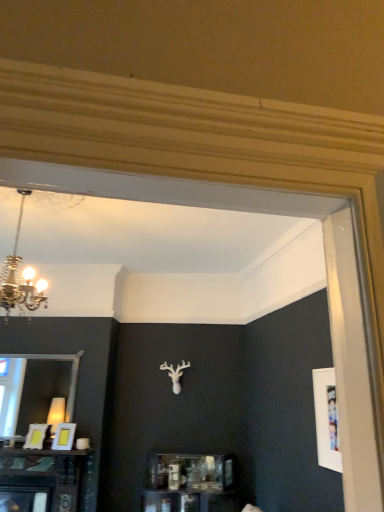
In the scene shown: What is the approximate height of matte white picture frame at lower left, positioned as the second picture frame in left-to-right order?

It is 11.27 inches.

Image resolution: width=384 pixels, height=512 pixels. Describe the element at coordinates (64, 436) in the screenshot. I see `matte white picture frame at lower left, positioned as the second picture frame in left-to-right order` at that location.

Where is `matte white picture frame at lower left, acting as the 1th picture frame starting from the right`? matte white picture frame at lower left, acting as the 1th picture frame starting from the right is located at coordinates (64, 436).

This screenshot has height=512, width=384. I want to click on matte yellow picture frame at lower left, marked as the first picture frame in a left-to-right arrangement, so click(x=36, y=436).

Image resolution: width=384 pixels, height=512 pixels. Describe the element at coordinates (36, 436) in the screenshot. I see `matte yellow picture frame at lower left, the second picture frame positioned from the right` at that location.

What is the approximate width of matte yellow picture frame at lower left, the second picture frame positioned from the right?

It is 3.51 inches.

Where is `matte white picture frame at lower left, positioned as the second picture frame in left-to-right order`? Image resolution: width=384 pixels, height=512 pixels. matte white picture frame at lower left, positioned as the second picture frame in left-to-right order is located at coordinates (64, 436).

Which object is positioned more to the left, matte white picture frame at lower left, acting as the 1th picture frame starting from the right, or matte yellow picture frame at lower left, marked as the first picture frame in a left-to-right arrangement?

matte yellow picture frame at lower left, marked as the first picture frame in a left-to-right arrangement, is more to the left.

Considering the relative positions of matte white picture frame at lower left, acting as the 1th picture frame starting from the right, and matte yellow picture frame at lower left, the second picture frame positioned from the right, in the image provided, is matte white picture frame at lower left, acting as the 1th picture frame starting from the right, behind matte yellow picture frame at lower left, the second picture frame positioned from the right,?

That is False.

Consider the image. Which point is more distant from viewer, (63, 426) or (27, 443)?

Point (27, 443)

From the image's perspective, is matte white picture frame at lower left, positioned as the second picture frame in left-to-right order, on matte yellow picture frame at lower left, marked as the first picture frame in a left-to-right arrangement?

Correct, matte white picture frame at lower left, positioned as the second picture frame in left-to-right order, appears higher than matte yellow picture frame at lower left, marked as the first picture frame in a left-to-right arrangement, in the image.

From a real-world perspective, does matte white picture frame at lower left, positioned as the second picture frame in left-to-right order, stand above matte yellow picture frame at lower left, the second picture frame positioned from the right?

Yes.

Is matte white picture frame at lower left, positioned as the second picture frame in left-to-right order, wider than matte yellow picture frame at lower left, the second picture frame positioned from the right?

Indeed, matte white picture frame at lower left, positioned as the second picture frame in left-to-right order, has a greater width compared to matte yellow picture frame at lower left, the second picture frame positioned from the right.

Does matte white picture frame at lower left, acting as the 1th picture frame starting from the right, have a lesser height compared to matte yellow picture frame at lower left, marked as the first picture frame in a left-to-right arrangement?

No, matte white picture frame at lower left, acting as the 1th picture frame starting from the right, is not shorter than matte yellow picture frame at lower left, marked as the first picture frame in a left-to-right arrangement.

Can you confirm if matte white picture frame at lower left, positioned as the second picture frame in left-to-right order, is bigger than matte yellow picture frame at lower left, the second picture frame positioned from the right?

Correct, matte white picture frame at lower left, positioned as the second picture frame in left-to-right order, is larger in size than matte yellow picture frame at lower left, the second picture frame positioned from the right.

Does matte white picture frame at lower left, positioned as the second picture frame in left-to-right order, contain matte yellow picture frame at lower left, the second picture frame positioned from the right?

That's incorrect, matte yellow picture frame at lower left, the second picture frame positioned from the right, is not inside matte white picture frame at lower left, positioned as the second picture frame in left-to-right order.

Is matte white picture frame at lower left, positioned as the second picture frame in left-to-right order, next to matte yellow picture frame at lower left, the second picture frame positioned from the right, and touching it?

matte white picture frame at lower left, positioned as the second picture frame in left-to-right order, is not next to matte yellow picture frame at lower left, the second picture frame positioned from the right, and they're not touching.

Is matte white picture frame at lower left, acting as the 1th picture frame starting from the right, turned away from matte yellow picture frame at lower left, the second picture frame positioned from the right?

No, matte yellow picture frame at lower left, the second picture frame positioned from the right, is not at the back of matte white picture frame at lower left, acting as the 1th picture frame starting from the right.

How many degrees apart are the facing directions of matte white picture frame at lower left, acting as the 1th picture frame starting from the right, and matte yellow picture frame at lower left, marked as the first picture frame in a left-to-right arrangement?

0.0337 degrees.

Where is `picture frame below the matte white picture frame at lower left, acting as the 1th picture frame starting from the right (from a real-world perspective)`? This screenshot has height=512, width=384. picture frame below the matte white picture frame at lower left, acting as the 1th picture frame starting from the right (from a real-world perspective) is located at coordinates (36, 436).

Is matte yellow picture frame at lower left, marked as the first picture frame in a left-to-right arrangement, at the left side of matte white picture frame at lower left, acting as the 1th picture frame starting from the right?

Yes.

Does matte yellow picture frame at lower left, the second picture frame positioned from the right, come in front of matte white picture frame at lower left, acting as the 1th picture frame starting from the right?

Result: That is False.

Is point (39, 434) farther from camera compared to point (57, 426)?

No, (39, 434) is in front of (57, 426).

From the image's perspective, relative to matte white picture frame at lower left, acting as the 1th picture frame starting from the right, is matte yellow picture frame at lower left, marked as the first picture frame in a left-to-right arrangement, above or below?

matte yellow picture frame at lower left, marked as the first picture frame in a left-to-right arrangement, is situated lower than matte white picture frame at lower left, acting as the 1th picture frame starting from the right, in the image.

From a real-world perspective, is matte yellow picture frame at lower left, marked as the first picture frame in a left-to-right arrangement, physically located above or below matte white picture frame at lower left, acting as the 1th picture frame starting from the right?

From a real-world perspective, matte yellow picture frame at lower left, marked as the first picture frame in a left-to-right arrangement, is physically below matte white picture frame at lower left, acting as the 1th picture frame starting from the right.

Does matte yellow picture frame at lower left, the second picture frame positioned from the right, have a lesser width compared to matte white picture frame at lower left, positioned as the second picture frame in left-to-right order?

Yes, matte yellow picture frame at lower left, the second picture frame positioned from the right, is thinner than matte white picture frame at lower left, positioned as the second picture frame in left-to-right order.

Does matte yellow picture frame at lower left, the second picture frame positioned from the right, have a lesser height compared to matte white picture frame at lower left, acting as the 1th picture frame starting from the right?

Yes.

Looking at the image, does matte yellow picture frame at lower left, marked as the first picture frame in a left-to-right arrangement, seem bigger or smaller compared to matte white picture frame at lower left, positioned as the second picture frame in left-to-right order?

matte yellow picture frame at lower left, marked as the first picture frame in a left-to-right arrangement, is smaller than matte white picture frame at lower left, positioned as the second picture frame in left-to-right order.

Based on the photo, is matte white picture frame at lower left, acting as the 1th picture frame starting from the right, inside matte yellow picture frame at lower left, marked as the first picture frame in a left-to-right arrangement?

No, matte yellow picture frame at lower left, marked as the first picture frame in a left-to-right arrangement, does not contain matte white picture frame at lower left, acting as the 1th picture frame starting from the right.

Is matte yellow picture frame at lower left, the second picture frame positioned from the right, not near matte white picture frame at lower left, acting as the 1th picture frame starting from the right?

No.

Is matte yellow picture frame at lower left, the second picture frame positioned from the right, positioned with its back to matte white picture frame at lower left, acting as the 1th picture frame starting from the right?

matte yellow picture frame at lower left, the second picture frame positioned from the right, does not have its back to matte white picture frame at lower left, acting as the 1th picture frame starting from the right.

How far apart are matte yellow picture frame at lower left, marked as the first picture frame in a left-to-right arrangement, and matte white picture frame at lower left, positioned as the second picture frame in left-to-right order?

7.38 inches.

The image size is (384, 512). What are the coordinates of `picture frame behind the matte white picture frame at lower left, acting as the 1th picture frame starting from the right` in the screenshot? It's located at (36, 436).

What are the coordinates of `picture frame that is above the matte yellow picture frame at lower left, the second picture frame positioned from the right (from a real-world perspective)` in the screenshot? It's located at (64, 436).

You are a GUI agent. You are given a task and a screenshot of the screen. Output one action in this format:
    pyautogui.click(x=<x>, y=<y>)
    Task: Click on the picture frame behind the matte white picture frame at lower left, acting as the 1th picture frame starting from the right
    The image size is (384, 512).
    Given the screenshot: What is the action you would take?
    tap(36, 436)